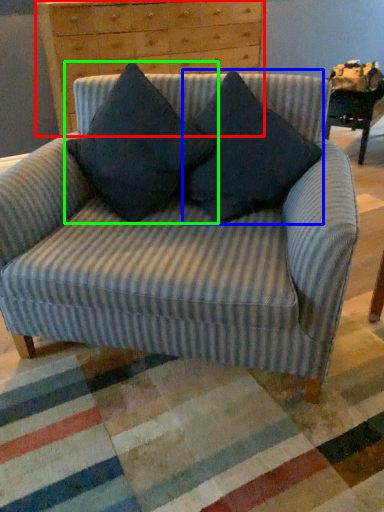
Question: Based on their relative distances, which object is farther from chest of drawers (highlighted by a red box)? Choose from pillow (highlighted by a blue box) and pillow (highlighted by a green box).

Choices:
 (A) pillow
 (B) pillow

Answer: (A)